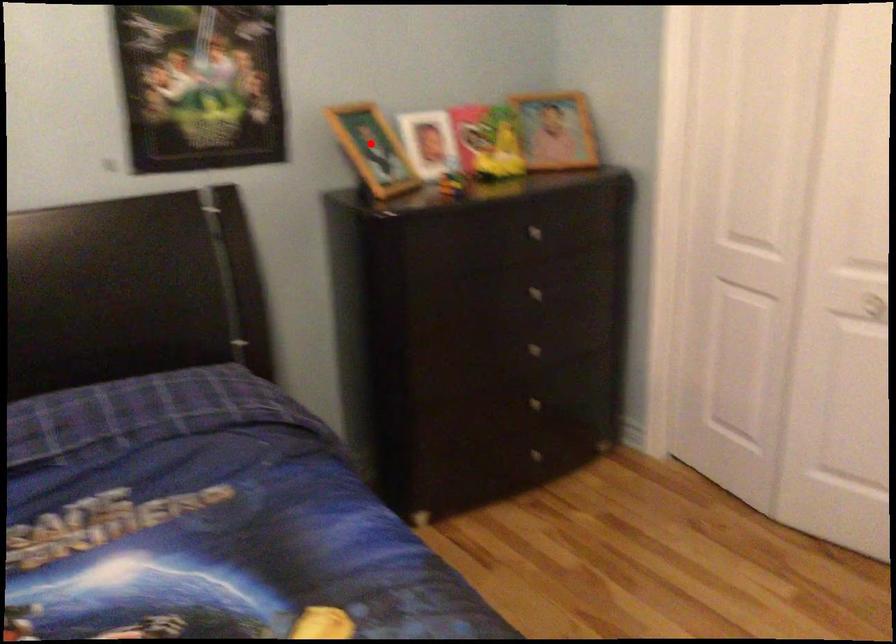
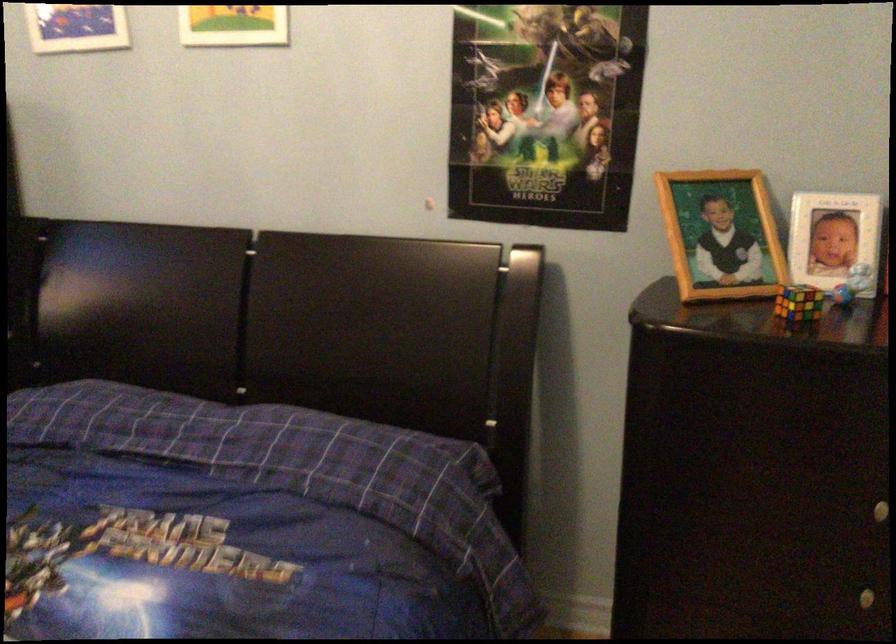
Question: I am providing you with two images of the same scene from different viewpoints. A red point is marked on the first image. At the location where the point appears in image 1, is it still visible in image 2?

Choices:
 (A) Yes
 (B) No

Answer: (A)